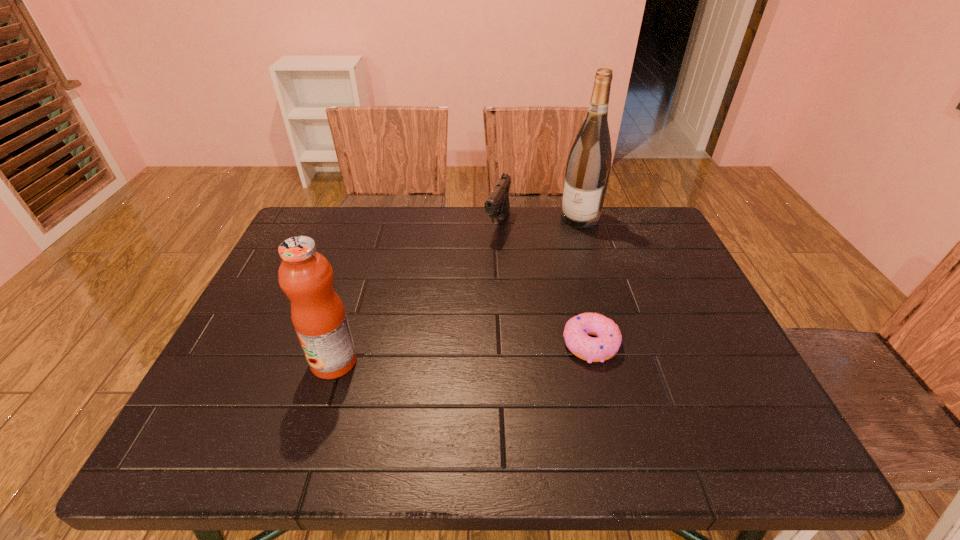
This screenshot has width=960, height=540. I want to click on vacant region located at the barrel of the pistol, so click(x=463, y=304).

The width and height of the screenshot is (960, 540). Identify the location of vacant region located 0.280m at the barrel of the pistol. (463, 304).

Identify the location of free location located at the barrel of the pistol. The height and width of the screenshot is (540, 960). click(x=451, y=327).

Where is `vacant position located 0.240m on the label of the tallest object`? vacant position located 0.240m on the label of the tallest object is located at coordinates (543, 272).

At what (x,y) coordinates should I click in order to perform the action: click on vacant space situated on the label of the tallest object. Please return your answer as a coordinate pair (x, y). The height and width of the screenshot is (540, 960). Looking at the image, I should click on (553, 258).

Identify the location of vacant region located on the label of the tallest object. This screenshot has width=960, height=540. (532, 289).

Identify the location of pistol situated at the far edge. The width and height of the screenshot is (960, 540). (497, 205).

In order to click on wine bottle present at the far edge in this screenshot , I will do `click(588, 168)`.

Find the location of a particular element. object situated at the near edge is located at coordinates (318, 315).

Image resolution: width=960 pixels, height=540 pixels. In the image, there is a desktop. Find the location of `free region at the far edge`. free region at the far edge is located at coordinates (451, 220).